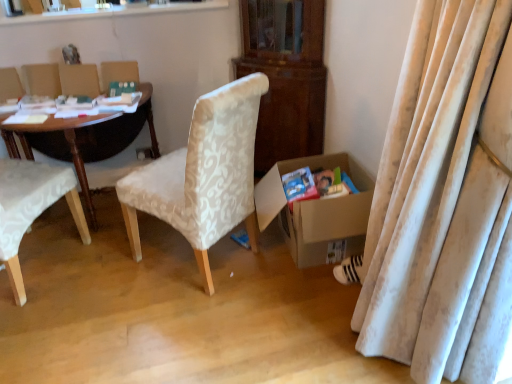
Question: From the image's perspective, relative to white fabric chair at left, the 2th chair viewed from the right, is white textured fabric chair at center, which is the second chair in left-to-right order, above or below?

Choices:
 (A) above
 (B) below

Answer: (A)

Question: From their relative heights in the image, would you say white textured fabric chair at center, the 1th chair in the right-to-left sequence, is taller or shorter than white fabric chair at left, which ranks as the 1th chair in left-to-right order?

Choices:
 (A) tall
 (B) short

Answer: (A)

Question: Which of these objects is positioned closest to the cardboard box at lower right?

Choices:
 (A) matte cardboard magazine at lower right
 (B) wooden polished desk at left
 (C) green matte paperback book at upper left, positioned as the first paperback book in top-to-bottom order
 (D) white textured fabric chair at center, the 1th chair in the right-to-left sequence
 (E) white fabric chair at left, which ranks as the 1th chair in left-to-right order

Answer: (A)

Question: Which of these objects is positioned farthest from the matte blue paperback book at lower right, positioned as the first paperback book in right-to-left order?

Choices:
 (A) matte cardboard magazine at lower right
 (B) cardboard box at lower right
 (C) white fabric chair at left, the 2th chair viewed from the right
 (D) white textured fabric chair at center, which is the second chair in left-to-right order
 (E) wooden polished desk at left

Answer: (E)